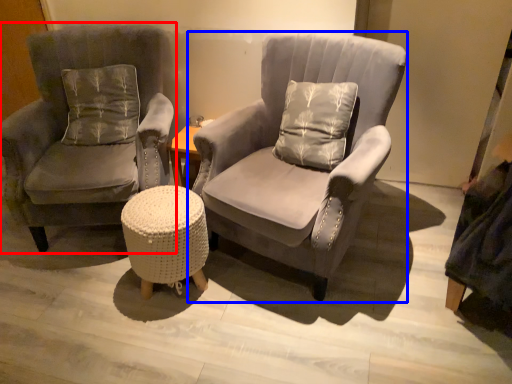
Question: Which object appears farthest to the camera in this image, chair (highlighted by a red box) or chair (highlighted by a blue box)?

Choices:
 (A) chair
 (B) chair

Answer: (A)